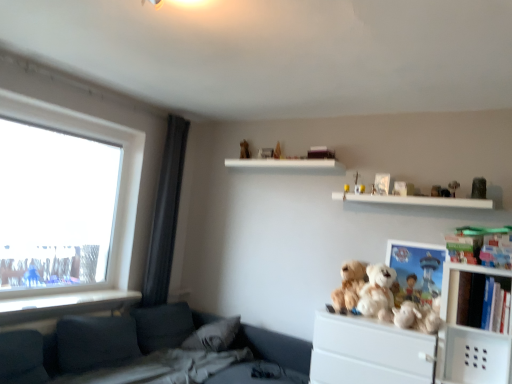
The width and height of the screenshot is (512, 384). What do you see at coordinates (165, 214) in the screenshot?
I see `dark gray fabric curtain at left` at bounding box center [165, 214].

What do you see at coordinates (481, 246) in the screenshot? I see `pastel pink plastic blocks at upper right, which is the first toy in right-to-left order` at bounding box center [481, 246].

What is the approximate height of gray fabric pillow at lower left?

gray fabric pillow at lower left is 12.20 inches tall.

The height and width of the screenshot is (384, 512). What do you see at coordinates (214, 335) in the screenshot?
I see `gray fabric pillow at lower left` at bounding box center [214, 335].

You are a GUI agent. You are given a task and a screenshot of the screen. Output one action in this format:
    pyautogui.click(x=<x>, y=<y>)
    Task: Click on the white plush toy at upper right, which is the fourth toy from right to left
    This screenshot has width=512, height=384.
    Given the screenshot: What is the action you would take?
    pyautogui.click(x=436, y=191)

Locate an element on the screen. The width and height of the screenshot is (512, 384). dark gray fabric curtain at left is located at coordinates (165, 214).

Is matte plastic picture frame at center-right placed right next to dark gray fabric curtain at left?

No, matte plastic picture frame at center-right is not touching dark gray fabric curtain at left.

Considering the sizes of matte plastic picture frame at center-right and dark gray fabric curtain at left in the image, is matte plastic picture frame at center-right wider or thinner than dark gray fabric curtain at left?

matte plastic picture frame at center-right is thinner than dark gray fabric curtain at left.

Consider the image. From their relative heights in the image, would you say matte plastic picture frame at center-right is taller or shorter than dark gray fabric curtain at left?

matte plastic picture frame at center-right is shorter than dark gray fabric curtain at left.

Can you tell me how much matte plastic picture frame at center-right and dark gray fabric curtain at left differ in facing direction?

88.6 degrees.

In terms of height, does white plush toy at upper right, which is the fourth toy from right to left, look taller or shorter compared to white plastic drawer at lower right?

In the image, white plush toy at upper right, which is the fourth toy from right to left, appears to be shorter than white plastic drawer at lower right.

Which object is closer to the camera taking this photo, white plush toy at upper right, the fifth toy when ordered from left to right, or white plastic drawer at lower right?

white plastic drawer at lower right is closer to the camera.

How different are the orientations of white plush toy at upper right, which is the fourth toy from right to left, and white plastic drawer at lower right in degrees?

The facing directions of white plush toy at upper right, which is the fourth toy from right to left, and white plastic drawer at lower right are 5.55 degrees apart.

Is point (435, 191) closer or farther from the camera than point (504, 368)?

Point (435, 191) appears to be farther away from the viewer than point (504, 368).

Relative to white plush bear at upper right, positioned as the 7th toy in left-to-right order, is white plush bear at upper center, acting as the 6th toy starting from the left, in front or behind?

In the image, white plush bear at upper center, acting as the 6th toy starting from the left, appears behind white plush bear at upper right, positioned as the 7th toy in left-to-right order.

How many degrees apart are the facing directions of white plush bear at upper center, acting as the third toy starting from the right, and white plush bear at upper right, acting as the 2th toy starting from the right?

The angle between the facing direction of white plush bear at upper center, acting as the third toy starting from the right, and the facing direction of white plush bear at upper right, acting as the 2th toy starting from the right, is 0.00168 degrees.

Based on the photo, considering the sizes of objects white plush bear at upper center, acting as the third toy starting from the right, and white plush bear at upper right, positioned as the 7th toy in left-to-right order, in the image provided, who is wider, white plush bear at upper center, acting as the third toy starting from the right, or white plush bear at upper right, positioned as the 7th toy in left-to-right order,?

white plush bear at upper right, positioned as the 7th toy in left-to-right order.

Between white plush bear at upper center, acting as the 6th toy starting from the left, and white plush bear at upper right, positioned as the 7th toy in left-to-right order, which one has more height?

white plush bear at upper right, positioned as the 7th toy in left-to-right order, is taller.

Is yellow plush toy at upper center, the seventh toy positioned from the right, taller or shorter than white plastic cabinet at right?

Considering their sizes, yellow plush toy at upper center, the seventh toy positioned from the right, has less height than white plastic cabinet at right.

From the picture: Considering the positions of objects yellow plush toy at upper center, arranged as the 2th toy when viewed from the left, and white plastic cabinet at right in the image provided, who is in front, yellow plush toy at upper center, arranged as the 2th toy when viewed from the left, or white plastic cabinet at right?

white plastic cabinet at right is more forward.

How distant is yellow plush toy at upper center, arranged as the 2th toy when viewed from the left, from white plastic cabinet at right?

They are 3.91 feet apart.

From a real-world perspective, is yellow plush toy at upper center, arranged as the 2th toy when viewed from the left, over white plastic cabinet at right?

Correct, in the physical world, yellow plush toy at upper center, arranged as the 2th toy when viewed from the left, is higher than white plastic cabinet at right.

Which is less distant, (434, 195) or (374, 190)?

Point (434, 195).

Is white plush toy at upper right, the fifth toy when ordered from left to right, bigger than white plush bear at upper center, the 3th toy in the left-to-right sequence?

Yes, white plush toy at upper right, the fifth toy when ordered from left to right, is bigger than white plush bear at upper center, the 3th toy in the left-to-right sequence.

How distant is white plush toy at upper right, which is the fourth toy from right to left, from white plush bear at upper center, the 3th toy in the left-to-right sequence?

They are 17.14 inches apart.

Considering the sizes of white plush toy at upper right, the fifth toy when ordered from left to right, and white plush bear at upper center, the sixth toy positioned from the right, in the image, is white plush toy at upper right, the fifth toy when ordered from left to right, taller or shorter than white plush bear at upper center, the sixth toy positioned from the right,?

white plush toy at upper right, the fifth toy when ordered from left to right, is shorter than white plush bear at upper center, the sixth toy positioned from the right.

Between white plush toy at upper right, the fifth toy when ordered from left to right, and gray fabric pillow at lower left, which one appears on the right side from the viewer's perspective?

From the viewer's perspective, white plush toy at upper right, the fifth toy when ordered from left to right, appears more on the right side.

Looking at their sizes, would you say white plush toy at upper right, the fifth toy when ordered from left to right, is wider or thinner than gray fabric pillow at lower left?

Considering their sizes, white plush toy at upper right, the fifth toy when ordered from left to right, looks slimmer than gray fabric pillow at lower left.

What's the angular difference between white plush bear at upper center, the sixth toy positioned from the right, and fluffy white teddy bear at center-right, which is counted as the 5th toy, starting from the right,'s facing directions?

There is a 0.9-degree angle between the facing directions of white plush bear at upper center, the sixth toy positioned from the right, and fluffy white teddy bear at center-right, which is counted as the 5th toy, starting from the right.

Considering the positions of points (373, 183) and (375, 313), is point (373, 183) closer to camera compared to point (375, 313)?

No, (373, 183) is behind (375, 313).

From the image's perspective, which one is positioned lower, white plush bear at upper center, the sixth toy positioned from the right, or fluffy white teddy bear at center-right, which is counted as the 5th toy, starting from the right?

fluffy white teddy bear at center-right, which is counted as the 5th toy, starting from the right, appears lower in the image.

Would you say white plush bear at upper center, the sixth toy positioned from the right, contains fluffy white teddy bear at center-right, which is counted as the 5th toy, starting from the right?

No.

Where is `curtain that is above the matte plastic picture frame at center-right (from a real-world perspective)`? This screenshot has width=512, height=384. curtain that is above the matte plastic picture frame at center-right (from a real-world perspective) is located at coordinates [165, 214].

At what (x,y) coordinates should I click in order to perform the action: click on the 4th toy above the white plastic drawer at lower right (from the image's perspective). Please return your answer as a coordinate pair (x, y). Looking at the image, I should click on (436, 191).

Considering their positions, is matte plastic picture frame at center-right positioned closer to white plush bear at upper right, positioned as the 7th toy in left-to-right order, than white plush bear at upper center, the sixth toy positioned from the right?

The object closer to white plush bear at upper right, positioned as the 7th toy in left-to-right order, is matte plastic picture frame at center-right.

Based on their spatial positions, is white plush bear at upper right, positioned as the 7th toy in left-to-right order, or white plush bear at upper center, the 3th toy in the left-to-right sequence, closer to gray fabric pillow at lower left?

The object closer to gray fabric pillow at lower left is white plush bear at upper center, the 3th toy in the left-to-right sequence.

Considering their positions, is dark gray fabric curtain at left positioned further to white plastic cabinet at right than white plastic drawer at lower right?

dark gray fabric curtain at left is positioned further to the anchor white plastic cabinet at right.

Looking at the image, which one is located closer to gray fabric pillow at lower left, fluffy white stuffed toys at upper right, the 1th toy in the left-to-right sequence, or white plush toy at upper right, the fifth toy when ordered from left to right?

Among the two, fluffy white stuffed toys at upper right, the 1th toy in the left-to-right sequence, is located nearer to gray fabric pillow at lower left.

Estimate the real-world distances between objects in this image. Which object is further from fluffy white stuffed toys at upper right, the 1th toy in the left-to-right sequence, matte plastic picture frame at center-right or white plastic drawer at lower right?

Based on the image, white plastic drawer at lower right appears to be further to fluffy white stuffed toys at upper right, the 1th toy in the left-to-right sequence.

From the image, which object appears to be nearer to white plush bear at upper center, the sixth toy positioned from the right, white plastic drawer at lower right or white plush bear at upper right, positioned as the 7th toy in left-to-right order?

white plush bear at upper right, positioned as the 7th toy in left-to-right order, is closer to white plush bear at upper center, the sixth toy positioned from the right.

When comparing their distances from white plastic cabinet at right, does white plush bear at upper right, positioned as the 7th toy in left-to-right order, or white plush bear at upper center, the sixth toy positioned from the right, seem closer?

white plush bear at upper right, positioned as the 7th toy in left-to-right order, lies closer to white plastic cabinet at right than the other object.

Based on their spatial positions, is gray fabric pillow at lower left or white plush bear at upper center, the sixth toy positioned from the right, further from white plastic cabinet at right?

gray fabric pillow at lower left is positioned further to the anchor white plastic cabinet at right.

The image size is (512, 384). I want to click on cabinet between white plush bear at upper center, the sixth toy positioned from the right, and fluffy white stuffed toys at upper right, which ranks as the eighth toy in right-to-left order, in the vertical direction, so click(458, 285).

What are the coordinates of `picture frame between white plush bear at upper center, acting as the 6th toy starting from the left, and white plastic cabinet at right from top to bottom` in the screenshot? It's located at coord(415,270).

The width and height of the screenshot is (512, 384). Identify the location of toy situated between dark gray fabric curtain at left and yellow plush toy at upper center, arranged as the 2th toy when viewed from the left, from left to right. (x=349, y=285).

Find the location of a particular element. This screenshot has height=384, width=512. picture frame between dark gray fabric curtain at left and white plastic cabinet at right in the horizontal direction is located at coordinates (415, 270).